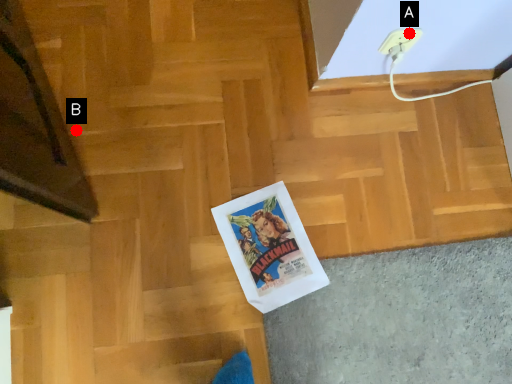
Question: Two points are circled on the image, labeled by A and B beside each circle. Which point is farther from the camera taking this photo?

Choices:
 (A) A is further
 (B) B is further

Answer: (B)